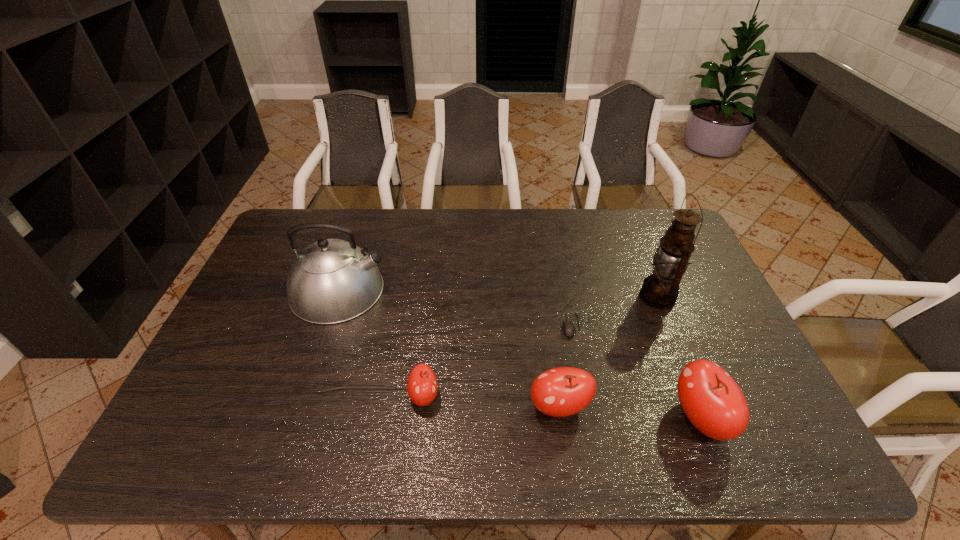
The width and height of the screenshot is (960, 540). I want to click on blank area located 0.270m on the back of the second tallest apple, so click(544, 308).

You are a GUI agent. You are given a task and a screenshot of the screen. Output one action in this format:
    pyautogui.click(x=<x>, y=<y>)
    Task: Click on the vacant space situated 0.250m on the back of the rightmost apple
    
    Given the screenshot: What is the action you would take?
    pyautogui.click(x=659, y=313)

You are a GUI agent. You are given a task and a screenshot of the screen. Output one action in this format:
    pyautogui.click(x=<x>, y=<y>)
    Task: Click on the free point located on the left of the tallest object
    Image resolution: width=960 pixels, height=540 pixels.
    Given the screenshot: What is the action you would take?
    pyautogui.click(x=529, y=297)

Where is `vacant space located on the back of the mouse`? Image resolution: width=960 pixels, height=540 pixels. vacant space located on the back of the mouse is located at coordinates (557, 251).

I want to click on vacant space located from the spout of the kettle, so click(x=505, y=290).

Where is `object located in the left edge section of the desktop`? The height and width of the screenshot is (540, 960). object located in the left edge section of the desktop is located at coordinates (331, 281).

Identify the location of apple that is at the right edge. 713,402.

The width and height of the screenshot is (960, 540). Find the location of `oil lamp located at the right edge`. oil lamp located at the right edge is located at coordinates (660, 290).

Locate an element on the screen. This screenshot has height=540, width=960. object located in the near right corner section of the desktop is located at coordinates (713, 402).

Image resolution: width=960 pixels, height=540 pixels. What are the coordinates of `vacant space at the far edge` in the screenshot? It's located at (612, 242).